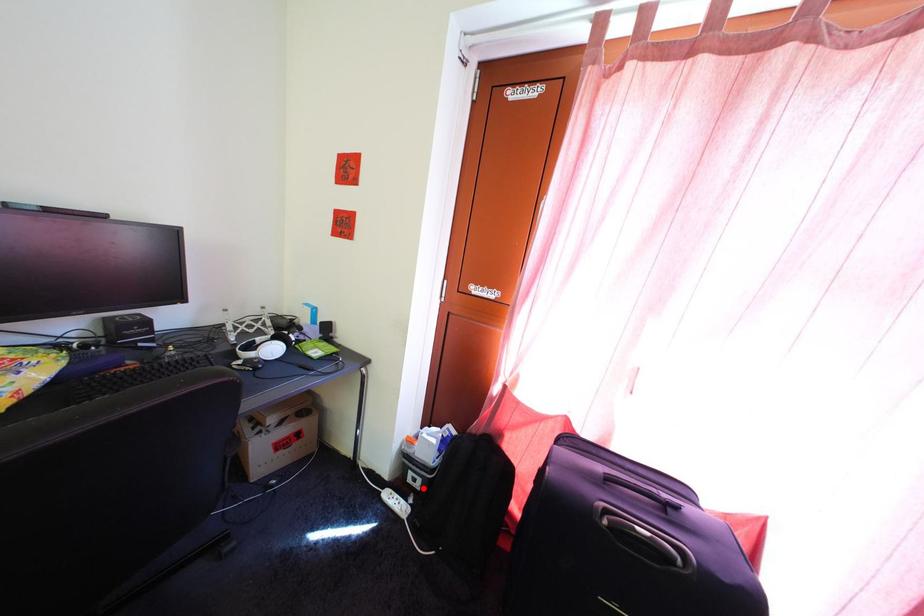
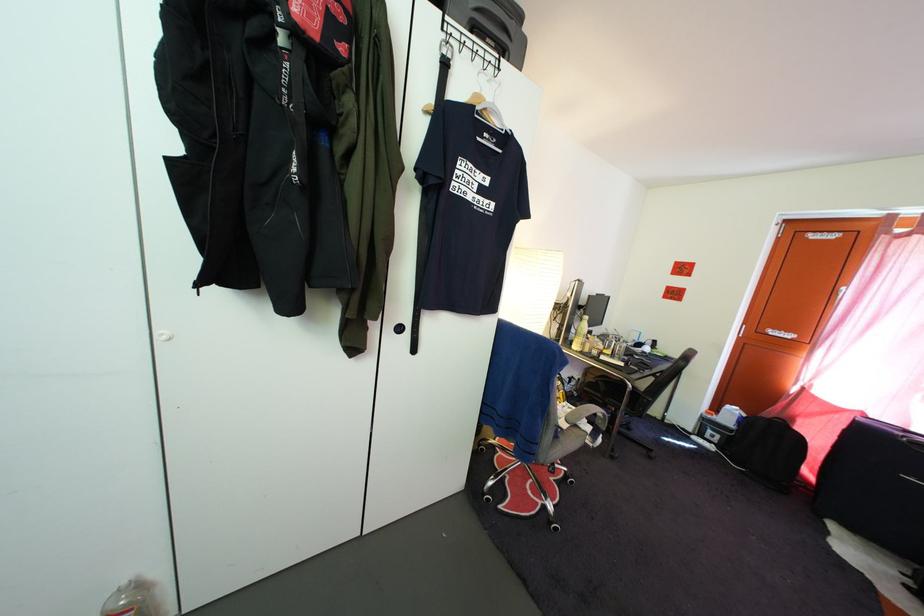
Question: I am providing you with two images of the same scene from different viewpoints. A red point is shown in image1. For the corresponding object point in image2, is it positioned nearer or farther from the camera?

Choices:
 (A) Nearer
 (B) Farther

Answer: (A)